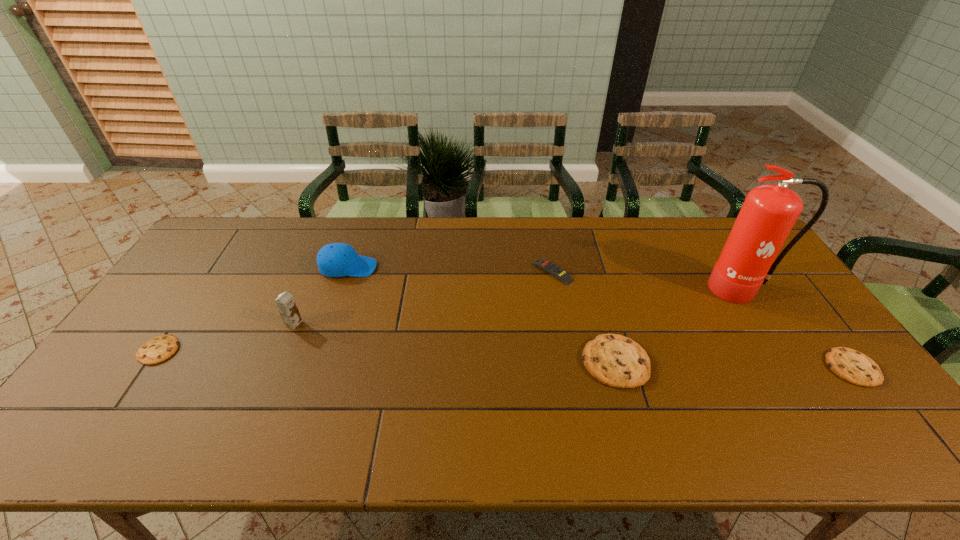
The width and height of the screenshot is (960, 540). I want to click on vacant region located on the back of the shortest object, so click(x=214, y=270).

Locate an element on the screen. vacant space located on the left of the fourth shortest object is located at coordinates (444, 362).

What are the coordinates of `free space located on the back of the rightmost cookie` in the screenshot? It's located at (819, 324).

Where is `vacant space located on the front-facing side of the fifth shortest object`? This screenshot has width=960, height=540. vacant space located on the front-facing side of the fifth shortest object is located at coordinates (396, 267).

Identify the location of free space located 0.250m on the back of the remote control. This screenshot has width=960, height=540. (542, 217).

What are the coordinates of `free space located 0.100m on the back of the chocolate milk` in the screenshot? It's located at (306, 293).

This screenshot has width=960, height=540. In order to click on free space located 0.190m towards the nozzle of the tallest object in this screenshot , I will do `click(785, 355)`.

Image resolution: width=960 pixels, height=540 pixels. I want to click on object that is at the far edge, so click(336, 259).

In order to click on object that is at the left edge in this screenshot , I will do `click(160, 348)`.

This screenshot has height=540, width=960. Identify the location of cookie that is at the right edge. (850, 365).